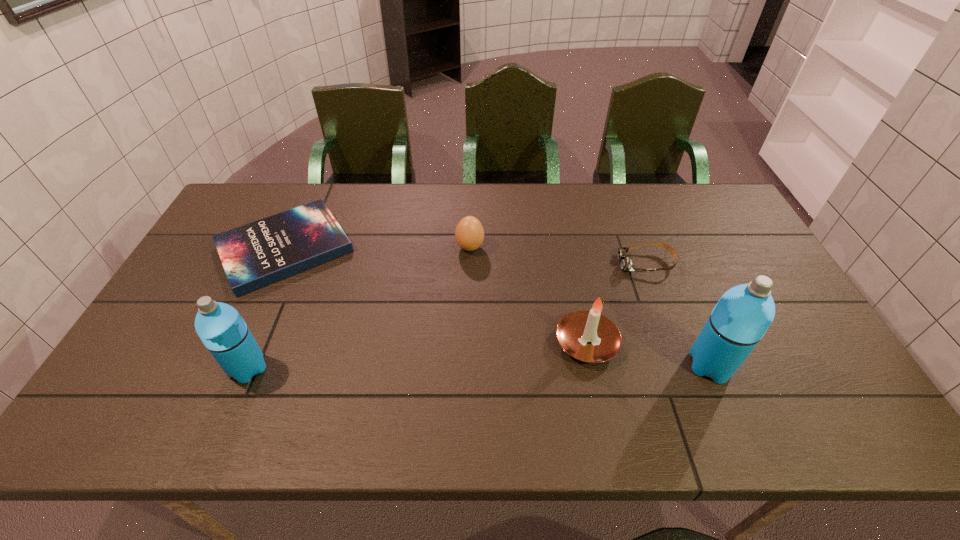
If we want them evenly spaced by inserting an extra thermos_bottle among them, please locate a free spot for this new thermos_bottle. Please provide its 2D coordinates. Your answer should be formatted as a tuple, i.e. [(x, y)], where the tuple contains the x and y coordinates of a point satisfying the conditions above.

[(480, 367)]